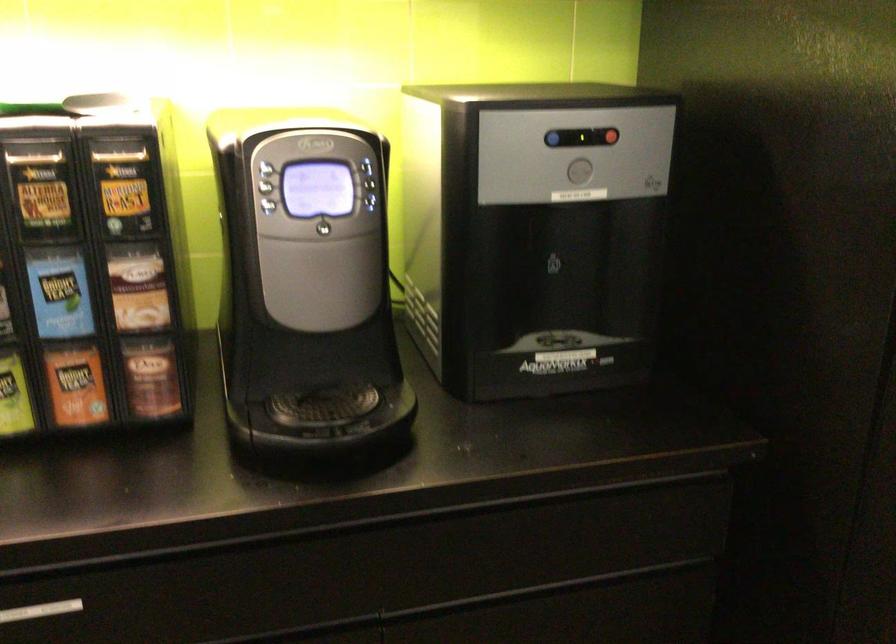
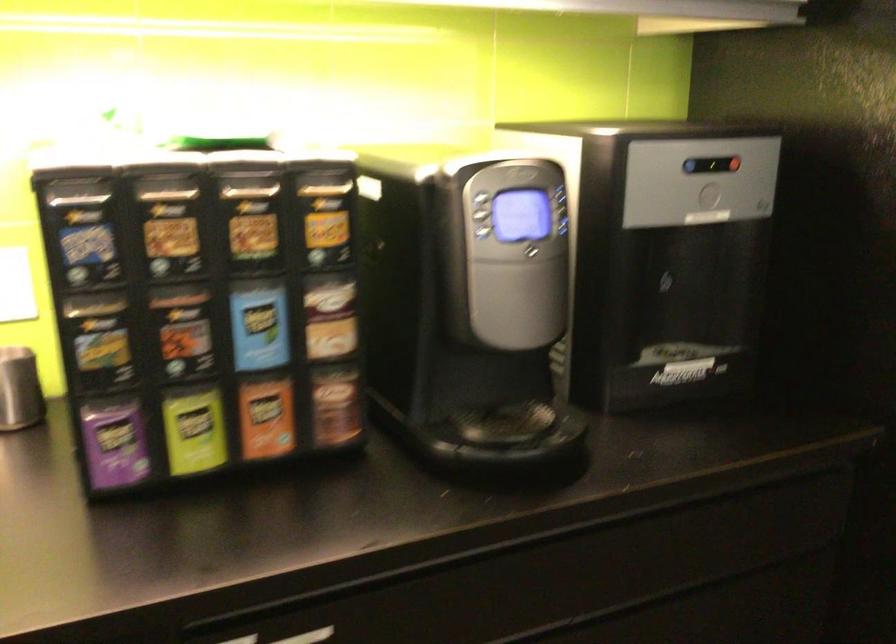
The point at (595,136) is marked in the first image. Where is the corresponding point in the second image?

(724, 163)